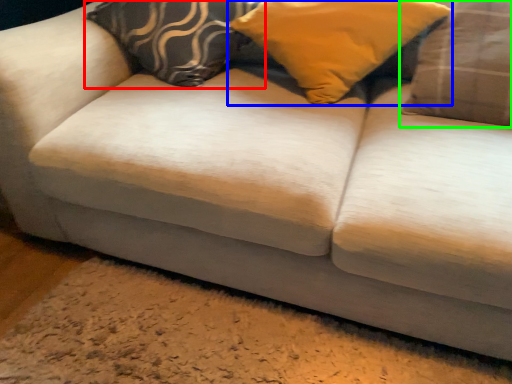
Question: Which object is the closest to the pillow (highlighted by a red box)? Choose among these: pillow (highlighted by a blue box) or pillow (highlighted by a green box).

Choices:
 (A) pillow
 (B) pillow

Answer: (A)